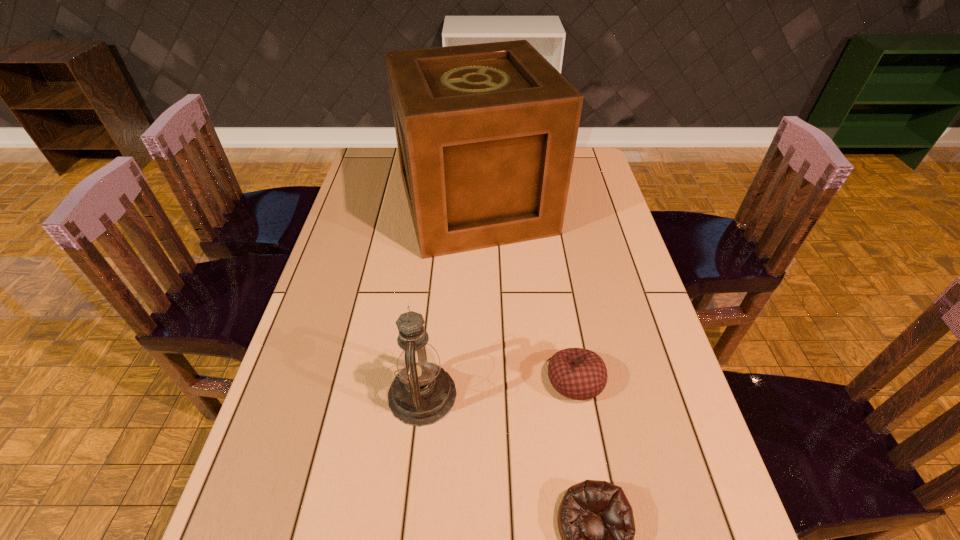
Identify the location of vacant space at the right edge of the desktop. This screenshot has width=960, height=540. (615, 233).

At what (x,y) coordinates should I click in order to perform the action: click on free point between the farthest object and the second tallest object. Please return your answer as a coordinate pair (x, y). This screenshot has width=960, height=540. Looking at the image, I should click on (449, 300).

At what (x,y) coordinates should I click in order to perform the action: click on free space that is in between the tallest object and the third tallest object. Please return your answer as a coordinate pair (x, y). Looking at the image, I should click on (525, 293).

This screenshot has height=540, width=960. I want to click on vacant area that lies between the third shortest object and the tallest object, so click(x=449, y=300).

You are a GUI agent. You are given a task and a screenshot of the screen. Output one action in this format:
    pyautogui.click(x=<x>, y=<y>)
    Task: Click on the vacant area that lies between the farther beanbag and the tallest object
    This screenshot has width=960, height=540.
    Given the screenshot: What is the action you would take?
    pyautogui.click(x=525, y=293)

Identify the location of free space between the taller beanbag and the oil lamp. Image resolution: width=960 pixels, height=540 pixels. pyautogui.click(x=498, y=387).

Where is `unoccupied position between the taller beanbag and the oil lamp`? The width and height of the screenshot is (960, 540). unoccupied position between the taller beanbag and the oil lamp is located at coordinates (498, 387).

The width and height of the screenshot is (960, 540). In order to click on the second closest object to the farther beanbag in this screenshot , I will do `click(422, 393)`.

Identify which object is located as the second nearest to the nearest object. Please provide its 2D coordinates. Your answer should be formatted as a tuple, i.e. [(x, y)], where the tuple contains the x and y coordinates of a point satisfying the conditions above.

[(422, 393)]

This screenshot has width=960, height=540. I want to click on blank area in the image that satisfies the following two spatial constraints: 1. on the back side of the taller beanbag; 2. on the left side of the oil lamp, so click(x=423, y=380).